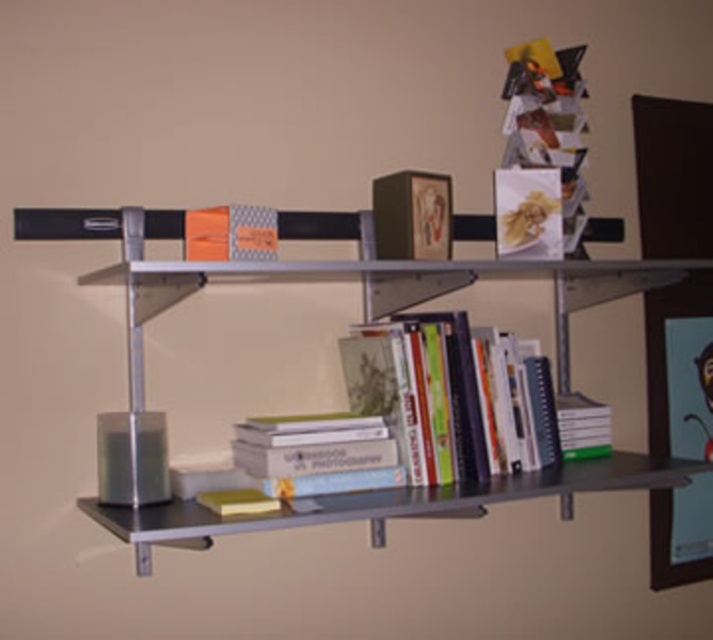
Question: Is metallic gray bookcase at center to the right of metallic picture frame at upper right from the viewer's perspective?

Choices:
 (A) yes
 (B) no

Answer: (B)

Question: Is metallic picture frame at upper right smaller than yellow matte book at lower center?

Choices:
 (A) yes
 (B) no

Answer: (B)

Question: Among these points, which one is farthest from the camera?

Choices:
 (A) (583, 195)
 (B) (689, 560)
 (C) (588, 410)

Answer: (B)

Question: Is metallic gray bookcase at center smaller than hardcover book at center?

Choices:
 (A) no
 (B) yes

Answer: (A)

Question: Which object is positioned closest to the orange matte book at center?

Choices:
 (A) metallic picture frame at upper right
 (B) hardcover book at center

Answer: (B)

Question: Which of the following is the closest to the observer?

Choices:
 (A) matte paper magazine at upper right
 (B) yellow matte book at lower center
 (C) hardcover books at center

Answer: (B)